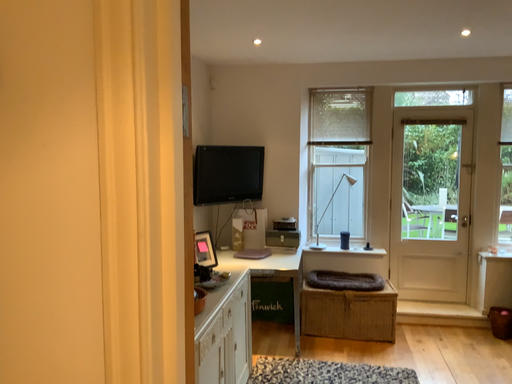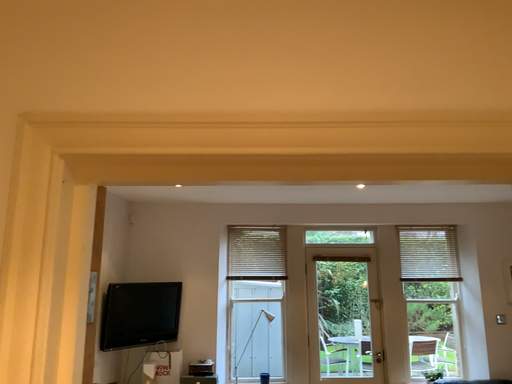
Question: Which way did the camera rotate in the video?

Choices:
 (A) rotated upward
 (B) rotated downward

Answer: (A)